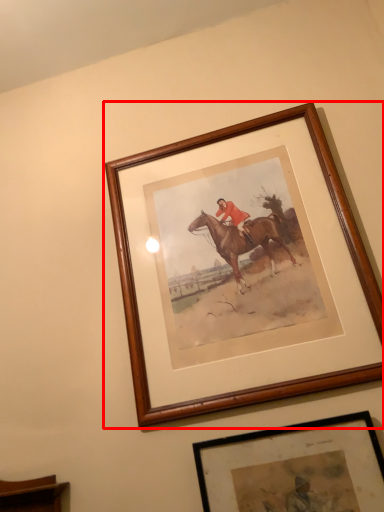
Question: In this image, where is picture frame (annotated by the red box) located relative to picture frame?

Choices:
 (A) left
 (B) right

Answer: (A)